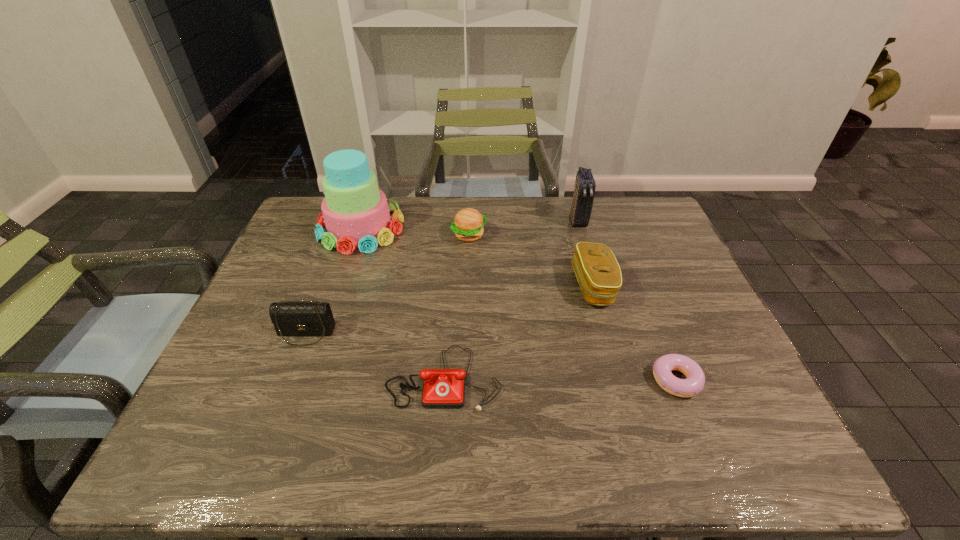
Where is `the tallest object`? The width and height of the screenshot is (960, 540). the tallest object is located at coordinates (355, 212).

Where is `the tallest clutch bag`? This screenshot has width=960, height=540. the tallest clutch bag is located at coordinates point(582,203).

Identify the location of the second tallest object. The width and height of the screenshot is (960, 540). (582, 203).

Where is `the second farthest clutch bag`? This screenshot has height=540, width=960. the second farthest clutch bag is located at coordinates (598, 273).

Find the location of `hamburger`. hamburger is located at coordinates click(x=468, y=224).

The width and height of the screenshot is (960, 540). I want to click on the third nearest object, so click(290, 318).

I want to click on the nearest clutch bag, so click(290, 318).

Image resolution: width=960 pixels, height=540 pixels. Identify the location of the sixth tallest object. (442, 388).

The image size is (960, 540). I want to click on the shortest object, so click(x=662, y=367).

Locate an element on the screen. The height and width of the screenshot is (540, 960). the rightmost object is located at coordinates click(x=662, y=367).